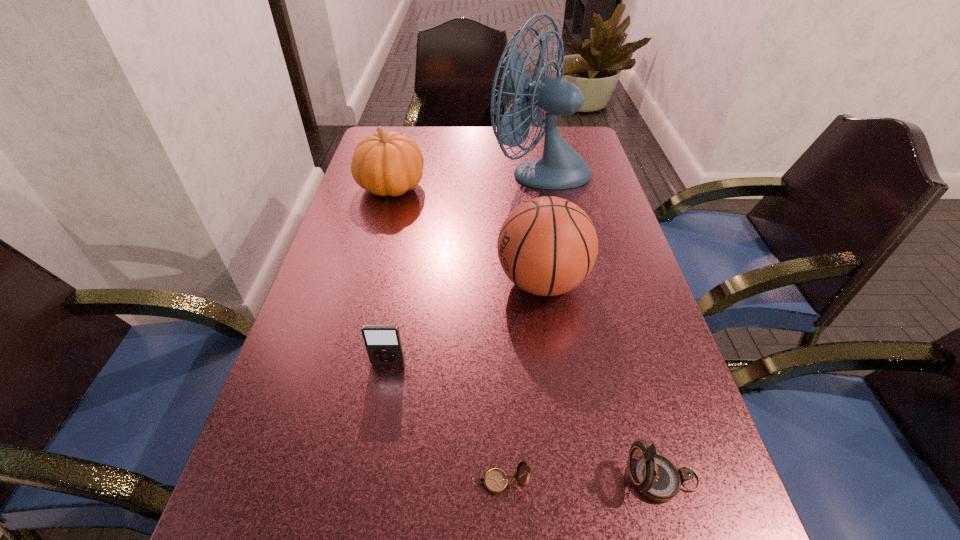
At what (x,y) coordinates should I click in order to perform the action: click on the tallest object. Please return your answer as a coordinate pair (x, y). The width and height of the screenshot is (960, 540). Looking at the image, I should click on (561, 167).

Locate an element on the screen. The image size is (960, 540). the fourth nearest object is located at coordinates (547, 246).

Where is `pumpkin`? pumpkin is located at coordinates (390, 163).

This screenshot has width=960, height=540. What are the coordinates of `the fourth farthest object` in the screenshot? It's located at (383, 343).

In order to click on the taller compass in this screenshot , I will do `click(656, 477)`.

Identify the location of the shorter compass. (496, 481).

I want to click on the shortest object, so click(x=496, y=481).

This screenshot has height=540, width=960. In order to click on vacant space positioned 0.120m in front of the fan to blow air in this screenshot , I will do `click(449, 171)`.

Identify the location of free space located in front of the fan to blow air. The image size is (960, 540). (436, 171).

The image size is (960, 540). Identify the location of vacant point located in front of the fan to blow air. (414, 171).